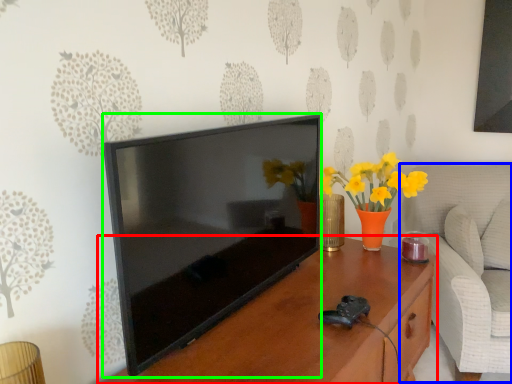
Question: Estimate the real-world distances between objects in this image. Which object is closer to table (highlighted by a red box), swivel chair (highlighted by a blue box) or television (highlighted by a green box)?

Choices:
 (A) swivel chair
 (B) television

Answer: (B)